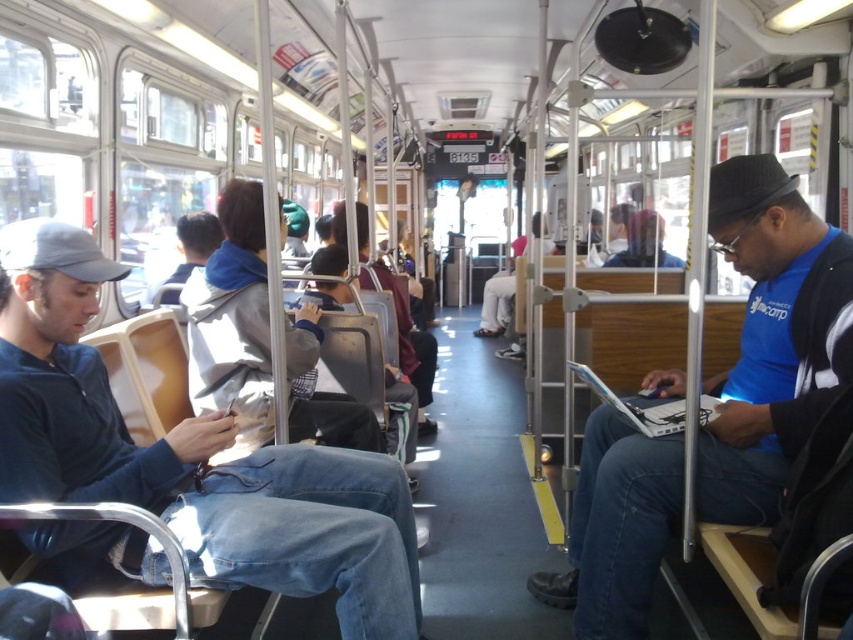
You are a passenger on a public transit vehicle and need to determine the relative height of two people based on their clothing. The denim jeans at left and the blue fabric shirt at center are visible. Which clothing item is shorter in height?

The denim jeans at left is shorter than the blue fabric shirt at center.

You are a passenger on this transit vehicle and want to borrow a phone charger from someone nearby. You see the denim jeans at left and the blue fabric shirt at center. Which person should you approach first to ask for help?

You should approach the denim jeans at left first because they are closer to you than the blue fabric shirt at center.

You are a delivery robot carrying a package that is 2 meters wide. You need to pass through the space between the denim jeans at left and the blue fabric shirt at center. Can you fit through the space between them?

The denim jeans at left might be wider than blue fabric shirt at center, so the space between them is uncertain. The robot should not attempt to pass through without more information about their exact positions.